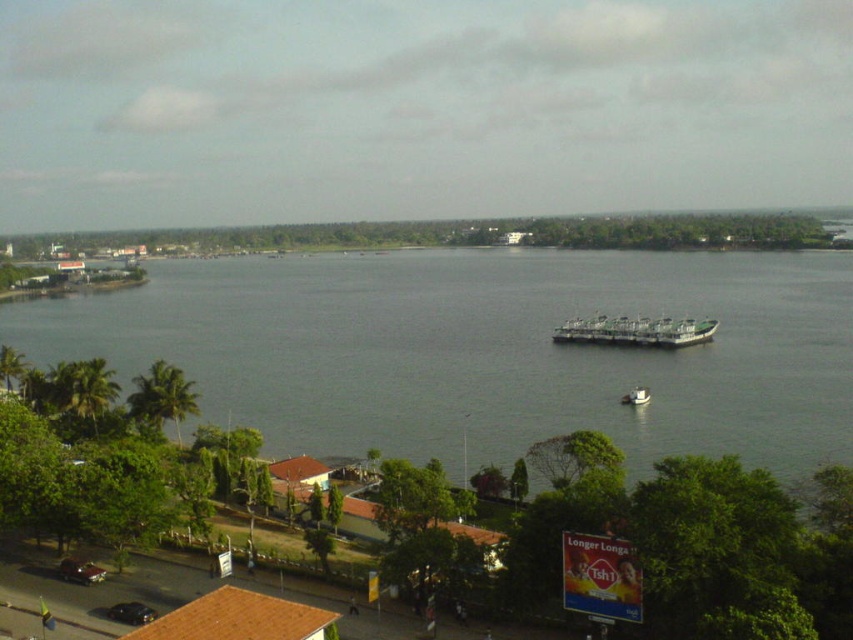
Between gray water at center and white matte boat at center, which one is positioned lower?

white matte boat at center is below.

The height and width of the screenshot is (640, 853). What do you see at coordinates (485, 349) in the screenshot? I see `gray water at center` at bounding box center [485, 349].

I want to click on gray water at center, so click(485, 349).

Is point (674, 298) farther from camera compared to point (654, 333)?

Yes, point (674, 298) is farther from viewer.

Does gray water at center have a greater width compared to green matte barge at center?

Correct, the width of gray water at center exceeds that of green matte barge at center.

The image size is (853, 640). What do you see at coordinates (485, 349) in the screenshot?
I see `gray water at center` at bounding box center [485, 349].

Identify the location of gray water at center. (485, 349).

Which of these two, green matte barge at center or white matte boat at center, stands shorter?

white matte boat at center

Measure the distance between green matte barge at center and camera.

A distance of 196.38 meters exists between green matte barge at center and camera.

Who is more forward, (680,344) or (634,401)?

Positioned in front is point (634,401).

Where is `green matte barge at center`? The image size is (853, 640). green matte barge at center is located at coordinates (635, 332).